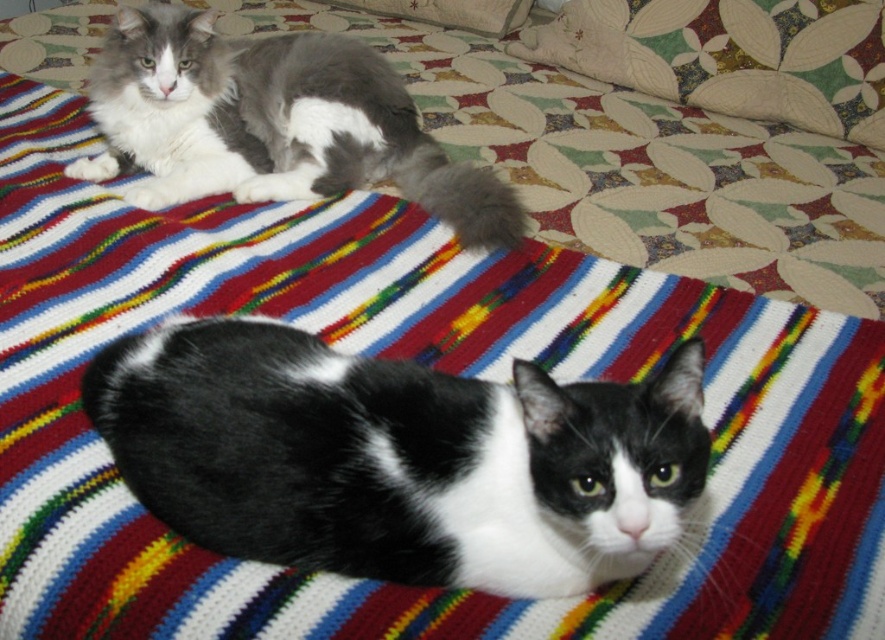
Can you confirm if black and white fur cat at lower center is positioned to the left of gray and white fur cat at upper left?

No, black and white fur cat at lower center is not to the left of gray and white fur cat at upper left.

Is point (528, 516) positioned before point (154, 13)?

That is True.

Find the location of a particular element. black and white fur cat at lower center is located at coordinates (399, 458).

What do you see at coordinates (399, 458) in the screenshot? I see `black and white fur cat at lower center` at bounding box center [399, 458].

Is black and white fur cat at lower center above fluffy white pillow at upper right?

Actually, black and white fur cat at lower center is below fluffy white pillow at upper right.

Which is behind, point (371, 568) or point (804, 22)?

Point (804, 22)

Find the location of a particular element. The height and width of the screenshot is (640, 885). black and white fur cat at lower center is located at coordinates (399, 458).

Is gray and white fur cat at upper left smaller than fluffy white pillow at upper right?

Indeed, gray and white fur cat at upper left has a smaller size compared to fluffy white pillow at upper right.

How distant is gray and white fur cat at upper left from fluffy white pillow at upper right?

gray and white fur cat at upper left is 34.40 inches away from fluffy white pillow at upper right.

This screenshot has height=640, width=885. I want to click on gray and white fur cat at upper left, so click(x=273, y=124).

Where is `gray and white fur cat at upper left`? gray and white fur cat at upper left is located at coordinates (273, 124).